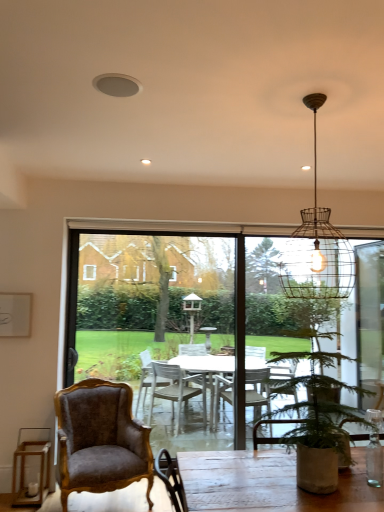
Question: Is green leafy plant in pot at lower right to the left of wire mesh pendant light at upper center from the viewer's perspective?

Choices:
 (A) yes
 (B) no

Answer: (A)

Question: Considering the relative sizes of green leafy plant in pot at lower right and wire mesh pendant light at upper center in the image provided, is green leafy plant in pot at lower right bigger than wire mesh pendant light at upper center?

Choices:
 (A) no
 (B) yes

Answer: (B)

Question: Considering the relative sizes of green leafy plant in pot at lower right and wire mesh pendant light at upper center in the image provided, is green leafy plant in pot at lower right thinner than wire mesh pendant light at upper center?

Choices:
 (A) yes
 (B) no

Answer: (B)

Question: Does green leafy plant in pot at lower right come in front of wire mesh pendant light at upper center?

Choices:
 (A) yes
 (B) no

Answer: (A)

Question: Is wire mesh pendant light at upper center located within green leafy plant in pot at lower right?

Choices:
 (A) no
 (B) yes

Answer: (A)

Question: Is green leafy plant in pot at lower right looking in the opposite direction of wire mesh pendant light at upper center?

Choices:
 (A) no
 (B) yes

Answer: (A)

Question: Considering the relative sizes of transparent glass table at center and wire mesh pendant light at upper center in the image provided, is transparent glass table at center taller than wire mesh pendant light at upper center?

Choices:
 (A) yes
 (B) no

Answer: (A)

Question: Is transparent glass table at center positioned with its back to wire mesh pendant light at upper center?

Choices:
 (A) yes
 (B) no

Answer: (B)

Question: Does transparent glass table at center lie behind wire mesh pendant light at upper center?

Choices:
 (A) no
 (B) yes

Answer: (B)

Question: From a real-world perspective, is transparent glass table at center below wire mesh pendant light at upper center?

Choices:
 (A) no
 (B) yes

Answer: (B)

Question: Does transparent glass table at center have a greater width compared to wire mesh pendant light at upper center?

Choices:
 (A) yes
 (B) no

Answer: (B)

Question: Is transparent glass table at center shorter than wire mesh pendant light at upper center?

Choices:
 (A) no
 (B) yes

Answer: (A)

Question: Considering the relative sizes of wire mesh pendant light at upper center and velvet brown armchair at lower left in the image provided, is wire mesh pendant light at upper center wider than velvet brown armchair at lower left?

Choices:
 (A) yes
 (B) no

Answer: (B)